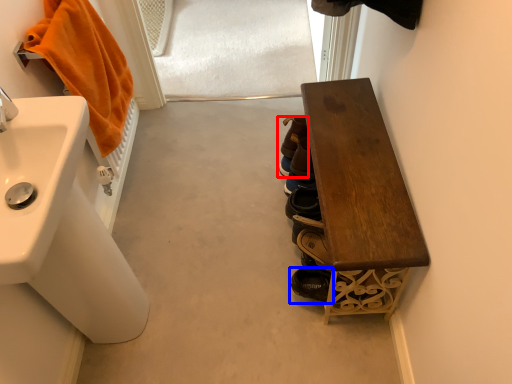
Question: Which of the following is the farthest to the observer, footwear (highlighted by a red box) or footwear (highlighted by a blue box)?

Choices:
 (A) footwear
 (B) footwear

Answer: (A)